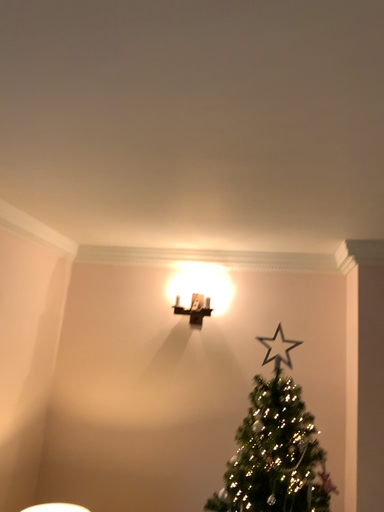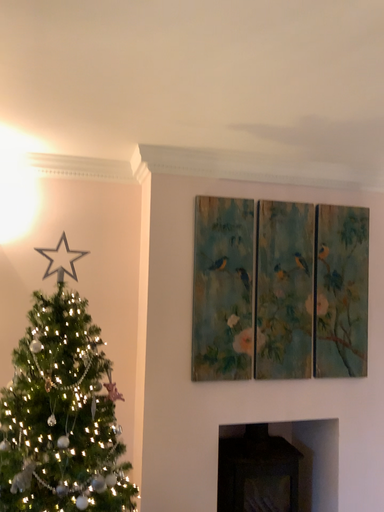
Question: How did the camera likely rotate when shooting the video?

Choices:
 (A) rotated upward
 (B) rotated downward

Answer: (B)